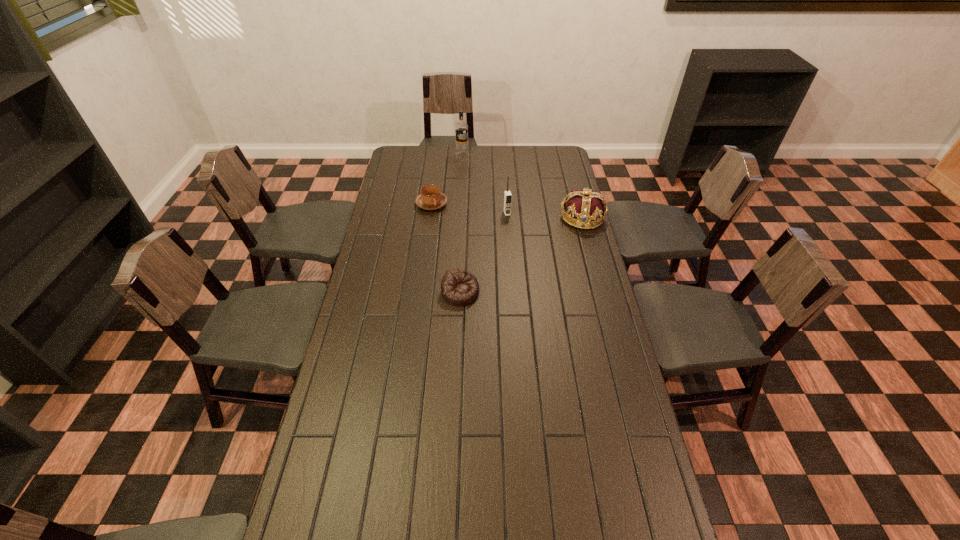
Locate an element on the screen. This screenshot has height=540, width=960. free space located on the front-facing side of the fourth object from left to right is located at coordinates (520, 252).

Locate an element on the screen. The height and width of the screenshot is (540, 960). free point located on the front-facing side of the fourth object from left to right is located at coordinates (523, 260).

Identify the location of free location located 0.140m on the front-facing side of the fourth object from left to right. The width and height of the screenshot is (960, 540). (515, 236).

This screenshot has height=540, width=960. Identify the location of blank area located 0.260m on the side of the cappuccino with the handle. (480, 239).

You are a GUI agent. You are given a task and a screenshot of the screen. Output one action in this format:
    pyautogui.click(x=<x>, y=<y>)
    Task: Click on the free point located 0.350m on the side of the cappuccino with the handle
    This screenshot has height=540, width=960.
    Given the screenshot: What is the action you would take?
    pyautogui.click(x=495, y=249)

Locate an element on the screen. The height and width of the screenshot is (540, 960). vacant space located 0.390m on the side of the cappuccino with the handle is located at coordinates coord(502,254).

Locate an element on the screen. free space located 0.290m on the label of the farthest object is located at coordinates (485, 188).

At what (x,y) coordinates should I click in order to perform the action: click on vacant area located on the label of the farthest object. Please return your answer as a coordinate pair (x, y). The width and height of the screenshot is (960, 540). Looking at the image, I should click on (481, 183).

This screenshot has height=540, width=960. I want to click on vacant area situated 0.300m on the label of the farthest object, so click(x=486, y=189).

Find the location of `object at the far edge`. object at the far edge is located at coordinates (461, 128).